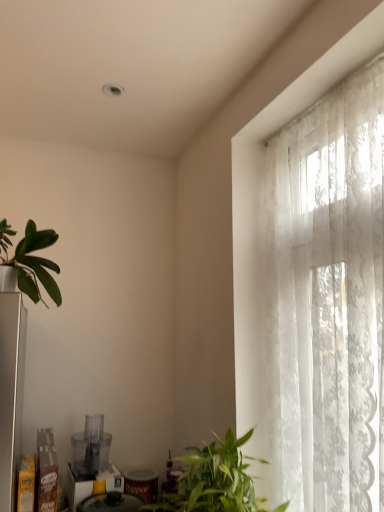
Question: In terms of height, does transparent plastic food processor at lower left, which is the 2th appliance in bottom-to-top order, look taller or shorter compared to green matte plant at left, the 1th houseplant from the left?

Choices:
 (A) tall
 (B) short

Answer: (B)

Question: Looking at the image, does transparent plastic food processor at lower left, which appears as the first appliance when viewed from the top, seem bigger or smaller compared to green matte plant at left, marked as the second houseplant in a bottom-to-top arrangement?

Choices:
 (A) small
 (B) big

Answer: (B)

Question: Considering the real-world distances, which object is closest to the white lace curtain at right?

Choices:
 (A) transparent plastic food processor at lower left, which is the 2th appliance in bottom-to-top order
 (B) green matte plant at left, which is the first houseplant from back to front
 (C) green leafy plant at lower right, placed as the 2th houseplant when sorted from left to right
 (D) matte plastic blender at lower left, which is the second appliance in top-to-bottom order

Answer: (C)

Question: Estimate the real-world distances between objects in this image. Which object is closer to the green leafy plant at lower right, the 1th houseplant viewed from the right?

Choices:
 (A) transparent plastic food processor at lower left, which appears as the first appliance when viewed from the top
 (B) white lace curtain at right
 (C) matte plastic blender at lower left, the first appliance when ordered from bottom to top
 (D) green matte plant at left, positioned as the 1th houseplant in top-to-bottom order

Answer: (B)